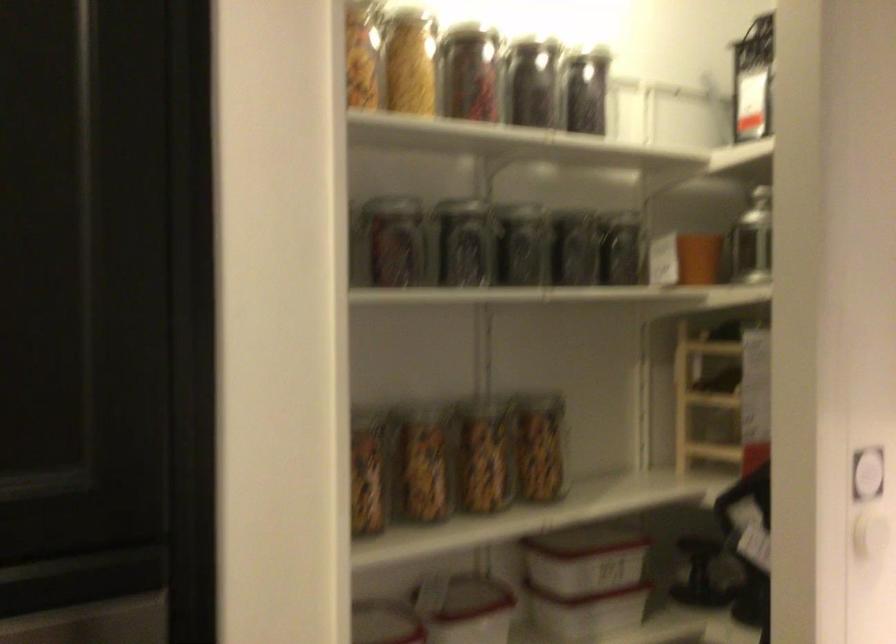
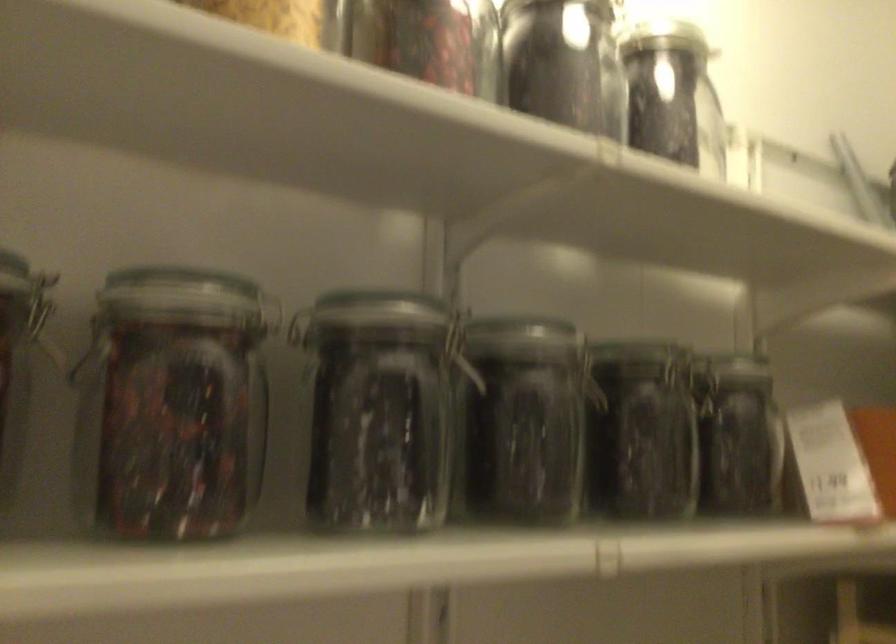
Locate, in the second image, the point that corresponds to the point at 522,245 in the first image.

(524, 420)